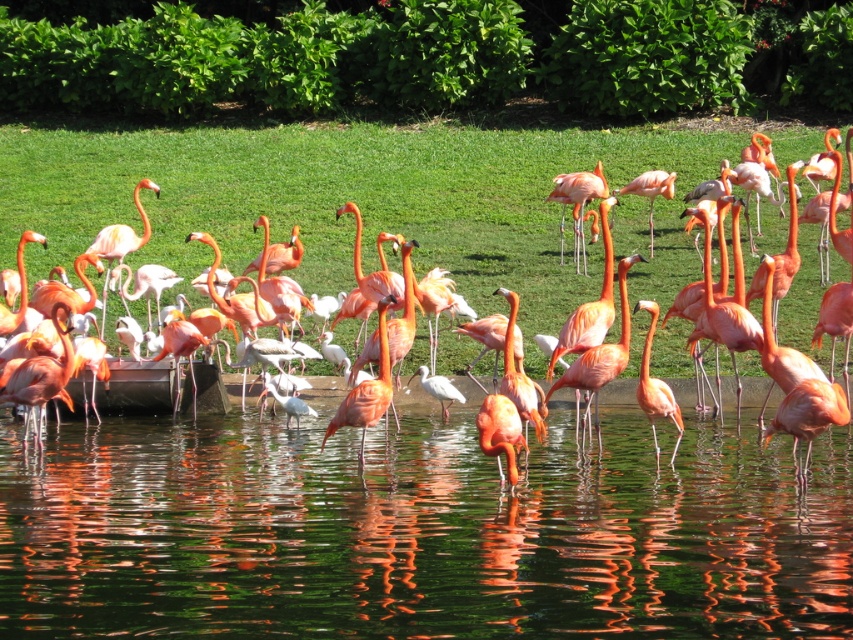
You are a flamingo standing at the point with coordinates point [57,548]. You want to fly to the point with coordinates point [639,301]. Will you have to fly over any other flamingos in your path?

Since point [57,548] is in front of point [639,301], the path from point [57,548] to point [639,301] would be towards the background. Therefore, you might have to fly over other flamingos that are positioned between these two points in the scene.